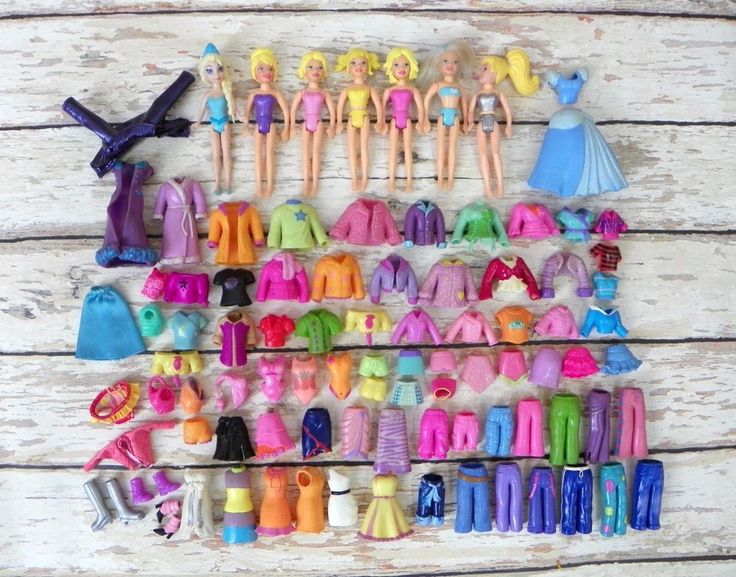
This screenshot has width=736, height=577. In order to click on plastic toy skirt in this screenshot , I will do `click(221, 430)`, `click(268, 428)`, `click(318, 426)`, `click(361, 426)`, `click(386, 427)`, `click(403, 393)`.